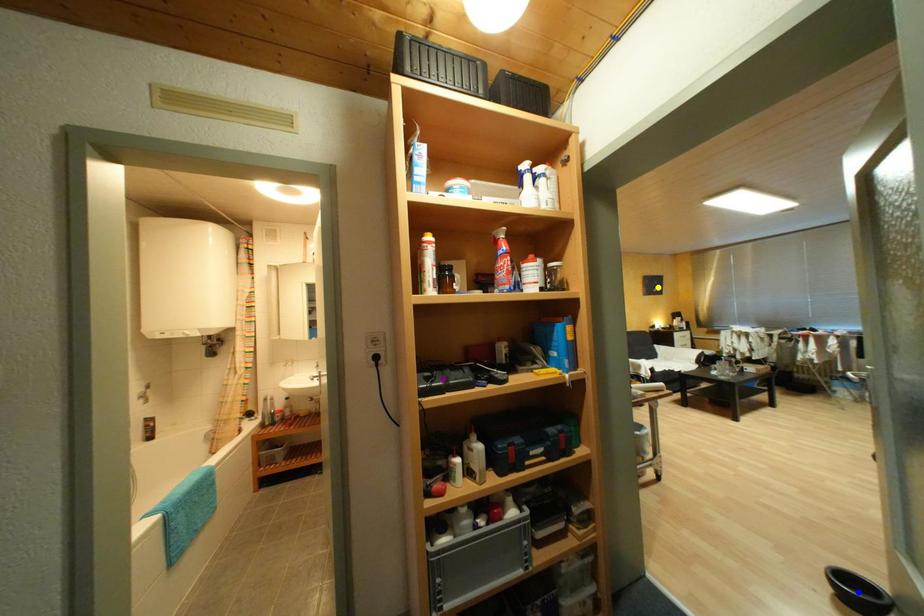
Order these from nearest to farthest:
A) blue point
B) yellow point
C) purple point

blue point → purple point → yellow point